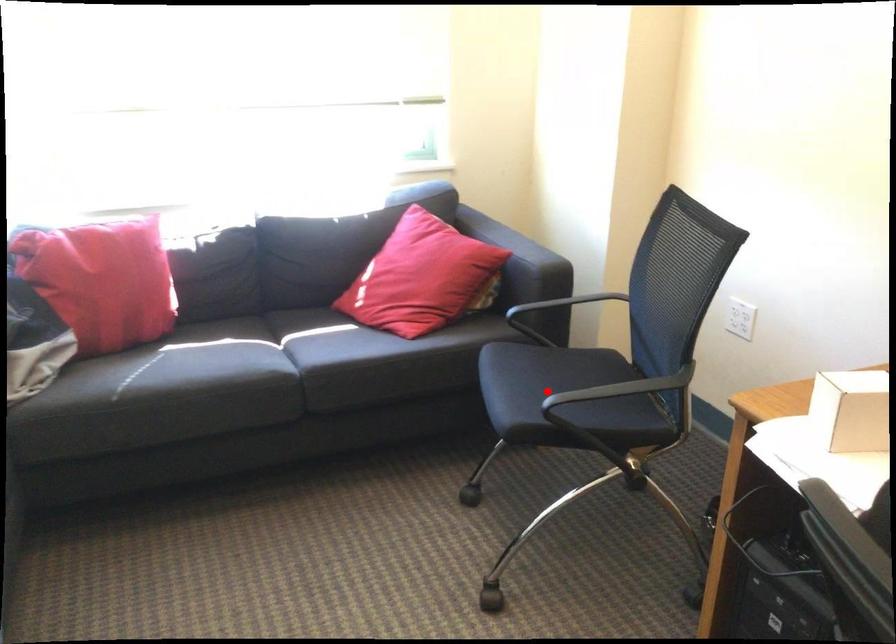
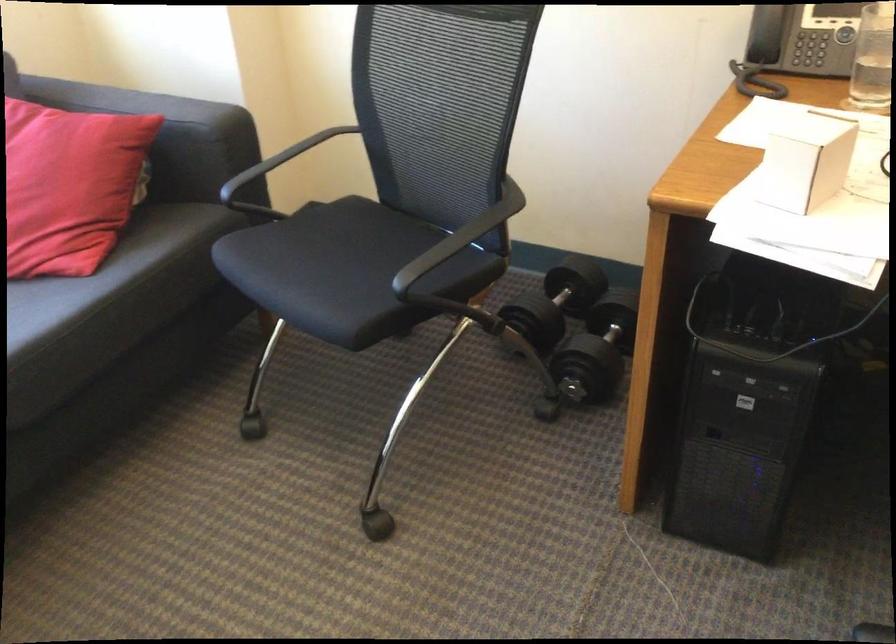
Question: I am providing you with two images of the same scene from different viewpoints. A red point is shown in image1. For the corresponding object point in image2, is it positioned nearer or farther from the camera?

Choices:
 (A) Nearer
 (B) Farther

Answer: (A)